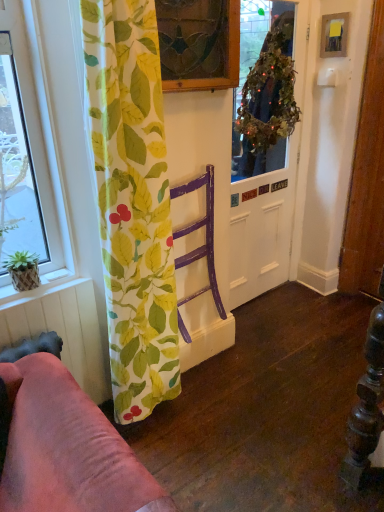
Find the location of a particular element. This screenshot has width=384, height=512. free point above woven bamboo plant pot at lower left (from a real-world perspective) is located at coordinates (36, 282).